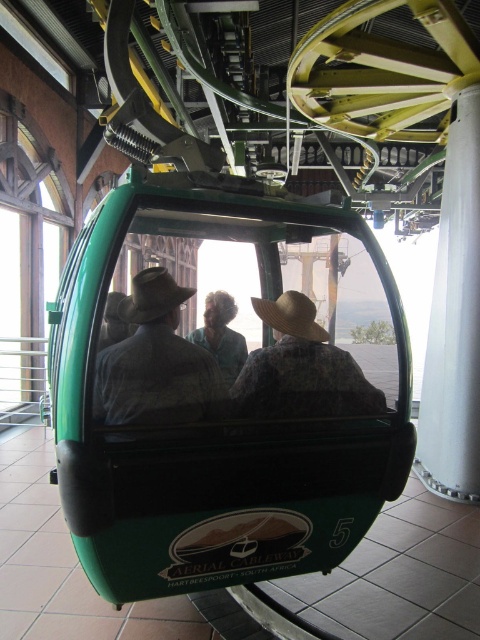
Which is in front, point (348, 298) or point (171, 369)?

Point (171, 369) is in front.

Who is more forward, [254,480] or [180,406]?

Point [180,406] is in front.

You are a GUI agent. You are given a task and a screenshot of the screen. Output one action in this format:
    pyautogui.click(x=<x>, y=<y>)
    Task: Click on the green matte/glossy cable car at center
    
    Given the screenshot: What is the action you would take?
    pyautogui.click(x=224, y=392)

Is green matte/glossy cable car at center shorter than floral fabric hat at center?

No, green matte/glossy cable car at center is not shorter than floral fabric hat at center.

The image size is (480, 640). What do you see at coordinates (224, 392) in the screenshot? I see `green matte/glossy cable car at center` at bounding box center [224, 392].

Where is `green matte/glossy cable car at center`? green matte/glossy cable car at center is located at coordinates (224, 392).

In order to click on green matte/glossy cable car at center in this screenshot , I will do `click(224, 392)`.

Does point (155, 378) lie behind point (106, 417)?

That is True.

Does green matte/glossy cable car at center appear on the left side of brown felt hat at center?

In fact, green matte/glossy cable car at center is to the right of brown felt hat at center.

Describe the element at coordinates (224, 392) in the screenshot. I see `green matte/glossy cable car at center` at that location.

Where is `green matte/glossy cable car at center`? green matte/glossy cable car at center is located at coordinates (224, 392).